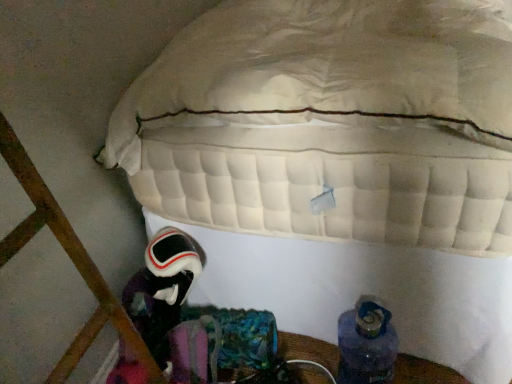
Question: From the image's perspective, relative to velvet-like black astronaut at lower left, is blue fabric boot at lower right above or below?

Choices:
 (A) below
 (B) above

Answer: (A)

Question: From a real-world perspective, is blue fabric boot at lower right physically located above or below velvet-like black astronaut at lower left?

Choices:
 (A) below
 (B) above

Answer: (A)

Question: In the image, is blue fabric boot at lower right on the left side or the right side of velvet-like black astronaut at lower left?

Choices:
 (A) left
 (B) right

Answer: (B)

Question: Considering the relative positions of velvet-like black astronaut at lower left and blue fabric boot at lower right in the image provided, is velvet-like black astronaut at lower left to the left or to the right of blue fabric boot at lower right?

Choices:
 (A) right
 (B) left

Answer: (B)

Question: Is velvet-like black astronaut at lower left spatially inside blue fabric boot at lower right, or outside of it?

Choices:
 (A) inside
 (B) outside

Answer: (B)

Question: From a real-world perspective, relative to blue fabric boot at lower right, is velvet-like black astronaut at lower left vertically above or below?

Choices:
 (A) below
 (B) above

Answer: (B)

Question: From the image's perspective, is velvet-like black astronaut at lower left located above or below blue fabric boot at lower right?

Choices:
 (A) below
 (B) above

Answer: (B)